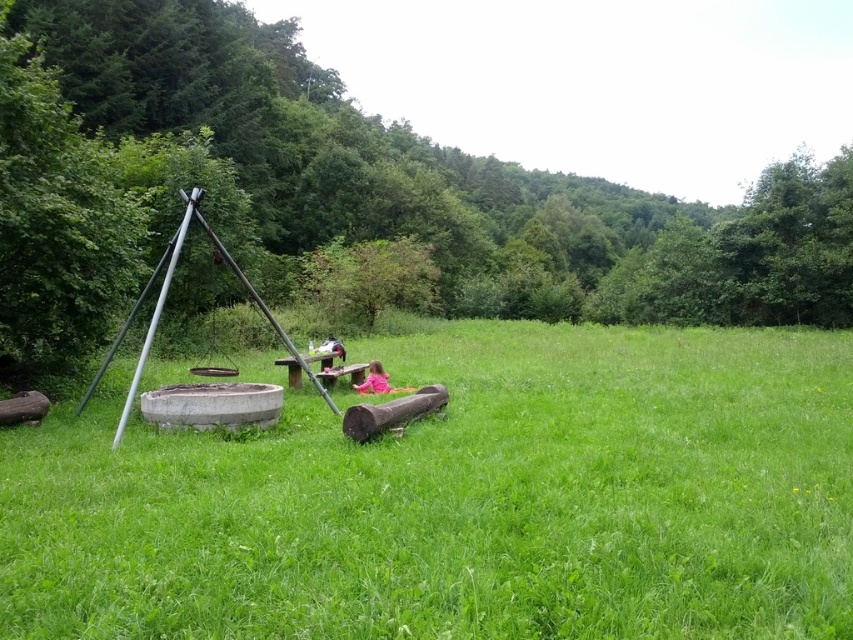
Consider the image. Which is above, green grass at center or pink fabric at center?

Positioned higher is green grass at center.

Is point (613, 394) closer to camera compared to point (379, 381)?

That is True.

Locate an element on the screen. The image size is (853, 640). green grass at center is located at coordinates (463, 500).

Where is `green grass at center`? green grass at center is located at coordinates (463, 500).

Is point (810, 400) farther from viewer compared to point (300, 189)?

No, (810, 400) is closer to viewer.

Is point (715, 515) farther from viewer compared to point (596, 188)?

No, (715, 515) is in front of (596, 188).

Where is `green grass at center`? The width and height of the screenshot is (853, 640). green grass at center is located at coordinates (463, 500).

Where is `green leafy tree at center`? Image resolution: width=853 pixels, height=640 pixels. green leafy tree at center is located at coordinates (447, 180).

How distant is green leafy tree at center from pink fabric at center?

green leafy tree at center and pink fabric at center are 50.28 meters apart.

Is point (469, 284) closer to viewer compared to point (370, 378)?

No, it is behind (370, 378).

You are a GUI agent. You are given a task and a screenshot of the screen. Output one action in this format:
    pyautogui.click(x=<x>, y=<y>)
    Task: Click on the green leafy tree at center
    The width and height of the screenshot is (853, 640).
    Given the screenshot: What is the action you would take?
    pyautogui.click(x=447, y=180)